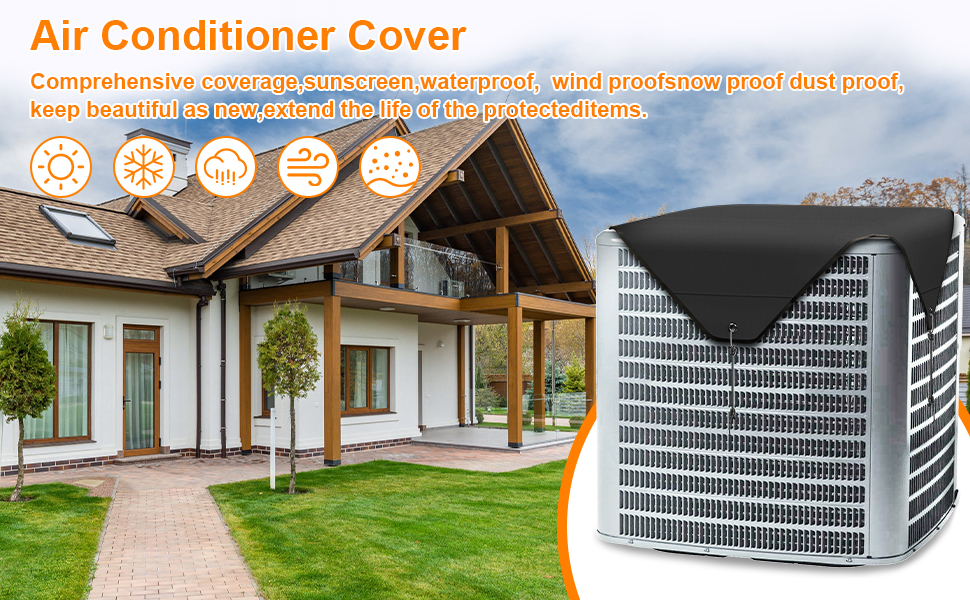
Identify the location of skylight. This screenshot has height=600, width=970. (71, 226).